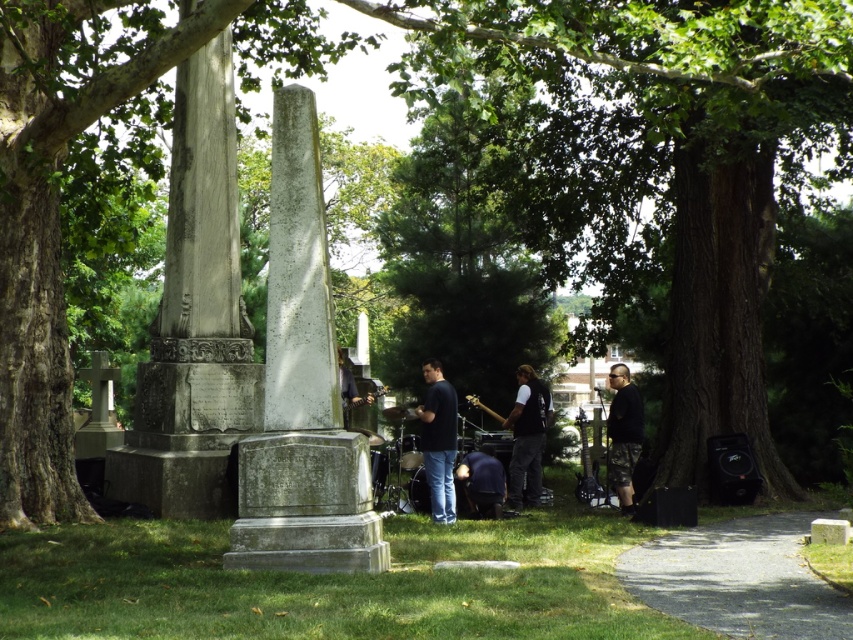
You are a photographer trying to capture a candid shot of the black matte vest at center and camouflage pants at lower right. Since you want to ensure both subjects are in focus, you need to know which one is taller. Can you tell me which object is taller?

The black matte vest at center is taller than the camouflage pants at lower right according to the description.

You are standing at the point labeled point (282, 403) and want to walk to the point labeled point (618, 490). Which direction should you move to get closer to your destination?

To move from point (282, 403) to point (618, 490), you should move towards the upper right direction since point (618, 490) is further away from the viewer compared to point (282, 403).

You are a photographer trying to capture a wide shot of the gray stone monument at center and the black matte vest at center. Since the monument is wider, how should you position your camera to ensure both are fully in frame?

Since the gray stone monument at center is wider than the black matte vest at center, you should position your camera closer to the monument to accommodate its larger width while still capturing the vest in the frame.